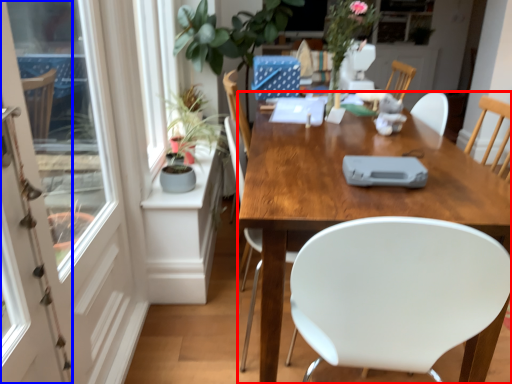
Question: Which object appears farthest to the camera in this image, desk (highlighted by a red box) or screen door (highlighted by a blue box)?

Choices:
 (A) desk
 (B) screen door

Answer: (A)